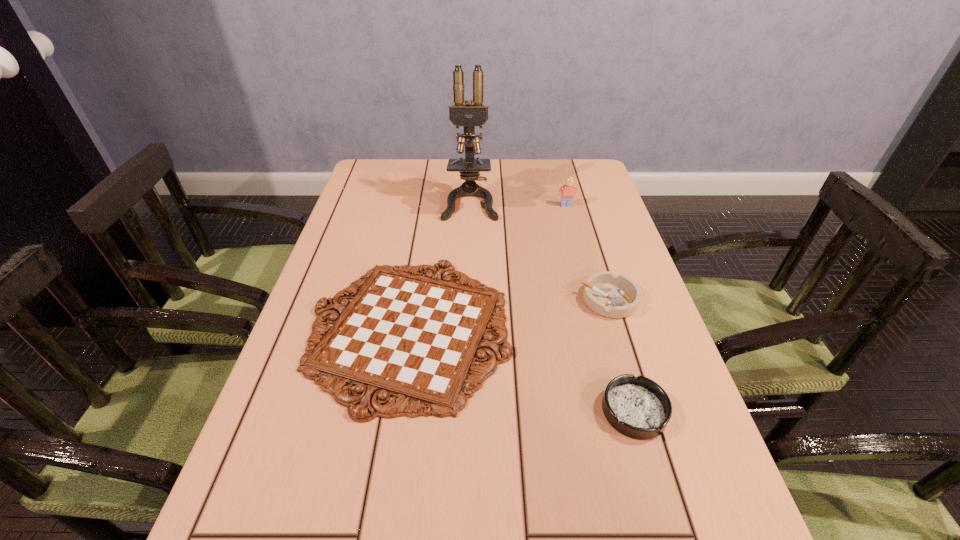
This screenshot has height=540, width=960. Find the location of `object that is at the far edge`. object that is at the far edge is located at coordinates (469, 115).

Identify the location of object present at the left edge. The width and height of the screenshot is (960, 540). (416, 338).

Where is `Lego that is at the right edge`? The width and height of the screenshot is (960, 540). Lego that is at the right edge is located at coordinates (568, 190).

Identify the location of blank space at the left edge of the desktop. This screenshot has height=540, width=960. (249, 502).

In the image, there is a desktop. Where is `vacant space at the right edge`? This screenshot has width=960, height=540. vacant space at the right edge is located at coordinates click(x=651, y=349).

Identify the location of free region at the far left corner of the desktop. (372, 165).

Image resolution: width=960 pixels, height=540 pixels. Find the location of `empty location between the Lego and the chessboard`. empty location between the Lego and the chessboard is located at coordinates (488, 268).

Image resolution: width=960 pixels, height=540 pixels. I want to click on vacant area that lies between the farther ashtray and the microscope, so click(x=540, y=251).

Locate an element on the screen. The image size is (960, 540). vacant area that lies between the chessboard and the nearer ashtray is located at coordinates (521, 370).

Where is `free space between the second tallest object and the shortest object`? The image size is (960, 540). free space between the second tallest object and the shortest object is located at coordinates (488, 268).